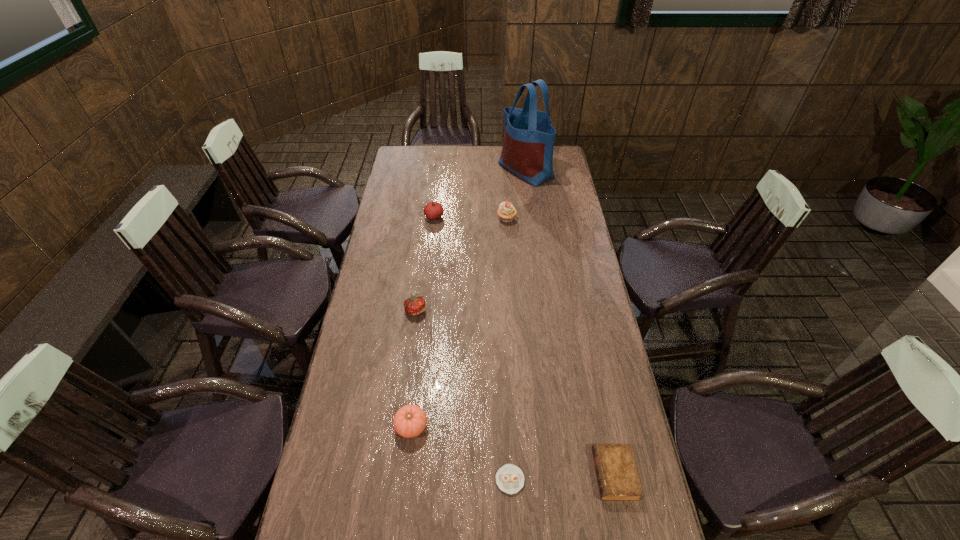
Locate which tomato is the second closest to the second nearest tomato. Please provide its 2D coordinates. Your answer should be formatted as a tuple, i.e. [(x, y)], where the tuple contains the x and y coordinates of a point satisfying the conditions above.

[(433, 210)]

In order to click on tomato object that ranks as the second closest to the third tallest object in this screenshot , I will do `click(410, 420)`.

Locate an element on the screen. This screenshot has height=540, width=960. vacant area that satisfies the following two spatial constraints: 1. on the front side of the tallest tomato; 2. on the right side of the nearest tomato is located at coordinates (410, 427).

Image resolution: width=960 pixels, height=540 pixels. In order to click on vacant space that satisfies the following two spatial constraints: 1. on the back side of the taller cupcake; 2. on the right side of the nearer cupcake in this screenshot , I will do `click(498, 219)`.

Where is `vacant area in the image that satisfies the following two spatial constraints: 1. on the back side of the farthest tomato; 2. on the right side of the tallest object`? The height and width of the screenshot is (540, 960). vacant area in the image that satisfies the following two spatial constraints: 1. on the back side of the farthest tomato; 2. on the right side of the tallest object is located at coordinates (440, 170).